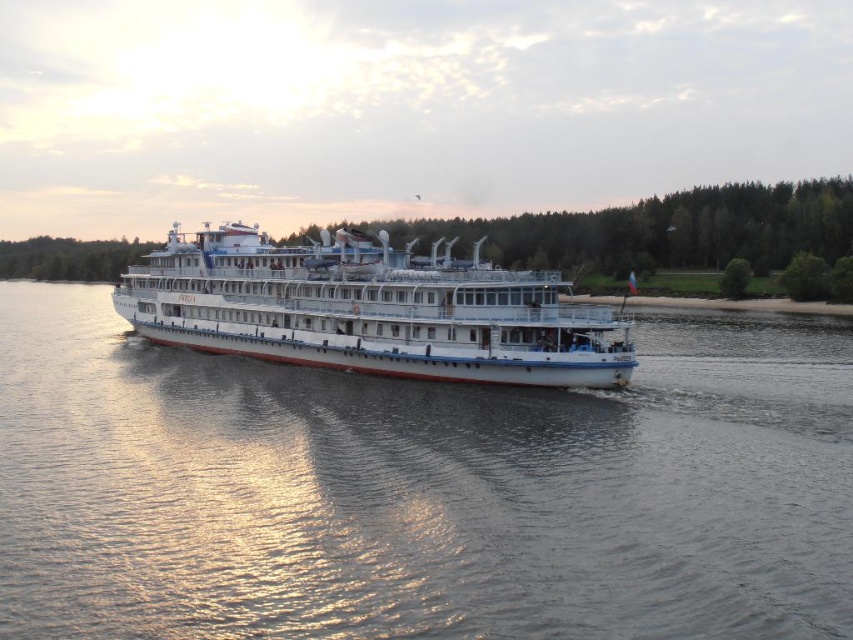
Question: Which of the following is the closest to the observer?

Choices:
 (A) white glossy cruise ship at center
 (B) white glossy water at center

Answer: (B)

Question: Is white glossy water at center to the right of white glossy cruise ship at center from the viewer's perspective?

Choices:
 (A) yes
 (B) no

Answer: (A)

Question: Which point is closer to the camera?

Choices:
 (A) pyautogui.click(x=247, y=349)
 (B) pyautogui.click(x=531, y=547)

Answer: (B)

Question: Observing the image, what is the correct spatial positioning of white glossy water at center in reference to white glossy cruise ship at center?

Choices:
 (A) right
 (B) left

Answer: (A)

Question: Considering the relative positions of white glossy water at center and white glossy cruise ship at center in the image provided, where is white glossy water at center located with respect to white glossy cruise ship at center?

Choices:
 (A) below
 (B) above

Answer: (A)

Question: Among these points, which one is farthest from the camera?

Choices:
 (A) (494, 470)
 (B) (309, 314)

Answer: (B)